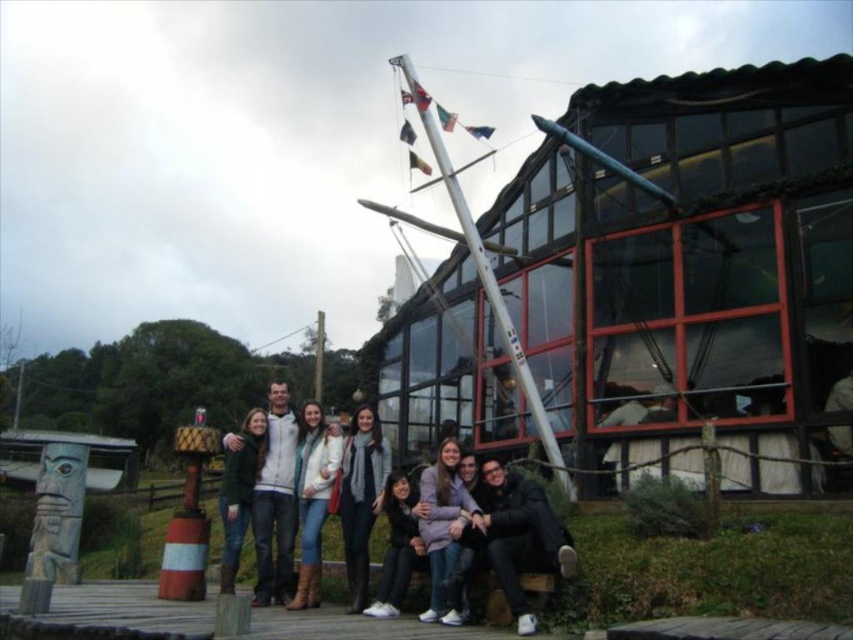
Question: Can you confirm if knitted scarf at center is positioned above light brown leather jacket at center?

Choices:
 (A) no
 (B) yes

Answer: (A)

Question: Does black leather jacket at lower center come in front of knitted scarf at center?

Choices:
 (A) yes
 (B) no

Answer: (A)

Question: Is matte black jacket at lower center above light brown leather jacket at center?

Choices:
 (A) no
 (B) yes

Answer: (A)

Question: Which point is farther to the camera?

Choices:
 (A) green wool sweater at center
 (B) white wooden mast at center

Answer: (B)

Question: Among these objects, which one is farthest from the camera?

Choices:
 (A) white woolen sweater at center
 (B) matte black jacket at lower center
 (C) green wool sweater at center

Answer: (C)

Question: Which is farther from the light purple fabric jacket at center?

Choices:
 (A) green wool sweater at center
 (B) black leather jacket at lower center
 (C) knitted scarf at center
 (D) white fleece jacket at center

Answer: (A)